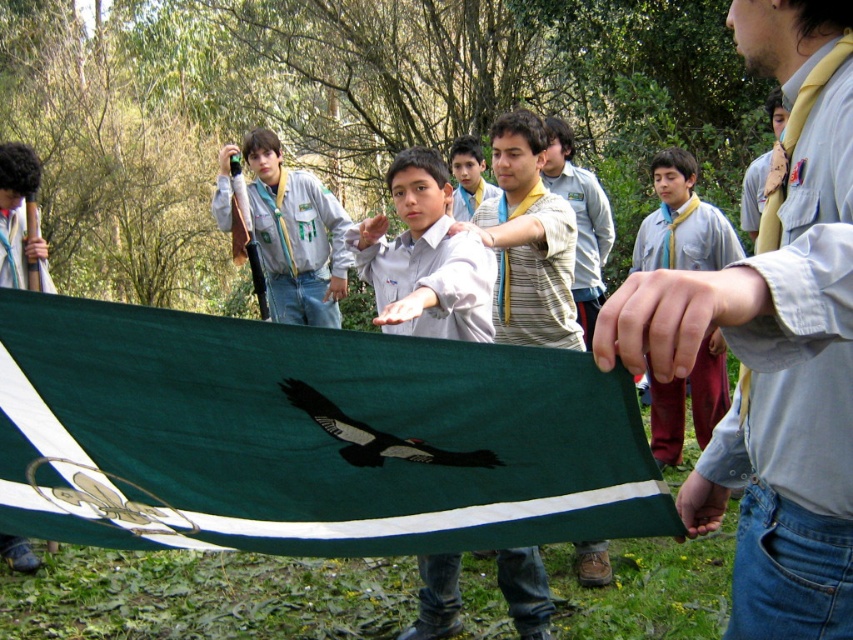
Question: Which is nearer to the green fabric flag at center?

Choices:
 (A) matte yellow tie at center
 (B) yellow fabric tie at center

Answer: (A)

Question: Is green fabric flag at center to the right of yellow fabric tie at center from the viewer's perspective?

Choices:
 (A) yes
 (B) no

Answer: (B)

Question: Can you confirm if matte yellow tie at center is thinner than yellow fabric tie at center?

Choices:
 (A) yes
 (B) no

Answer: (A)

Question: Which point is closer to the camera?

Choices:
 (A) (474, 458)
 (B) (683, 259)
 (C) (236, 348)
 (D) (630, 362)

Answer: (D)

Question: Where is matte yellow tie at center located in relation to dark brown glossy eagle at center in the image?

Choices:
 (A) below
 (B) above

Answer: (B)

Question: Which of the following is the closest to the observer?

Choices:
 (A) (724, 372)
 (B) (386, 454)

Answer: (B)